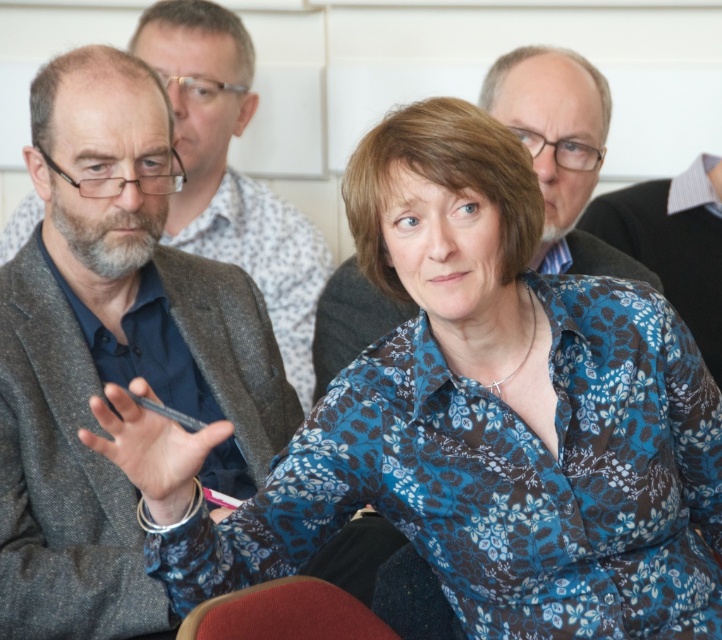
Question: Which point appears farthest from the camera in this image?

Choices:
 (A) (222, 64)
 (B) (362, 296)

Answer: (A)

Question: Can you confirm if gray woolen jacket at center is bigger than matte black jacket at upper center?

Choices:
 (A) yes
 (B) no

Answer: (A)

Question: Which object is the closest to the matte black jacket at upper center?

Choices:
 (A) gray woolen jacket at center
 (B) red fabric chair at lower center

Answer: (A)

Question: Which object is closer to the camera taking this photo?

Choices:
 (A) red fabric chair at lower center
 (B) gray woolen jacket at center

Answer: (A)

Question: Is matte black jacket at upper center behind red fabric chair at lower center?

Choices:
 (A) no
 (B) yes

Answer: (B)

Question: Is gray woolen jacket at center above matte black jacket at upper center?

Choices:
 (A) no
 (B) yes

Answer: (A)